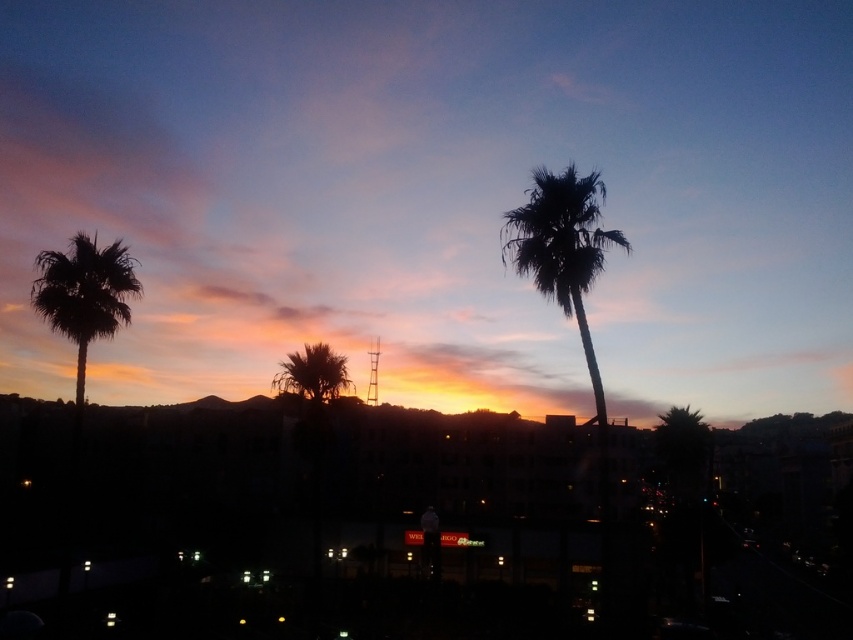
Question: Which object appears farthest from the camera in this image?

Choices:
 (A) silky brown palm tree at center
 (B) silhouette palm at center

Answer: (A)

Question: Is the position of silhouette palm at center less distant than that of silhouette palm at left?

Choices:
 (A) yes
 (B) no

Answer: (A)

Question: Does silhouette palm at center have a smaller size compared to silky brown palm tree at center?

Choices:
 (A) yes
 (B) no

Answer: (B)

Question: Which object appears farthest from the camera in this image?

Choices:
 (A) silky brown palm tree at center
 (B) silhouette palm at center
 (C) silhouette palm at left

Answer: (A)

Question: Does silhouette palm at left appear on the left side of silky brown palm tree at center?

Choices:
 (A) no
 (B) yes

Answer: (B)

Question: Among these points, which one is nearest to the camera?

Choices:
 (A) click(94, 316)
 (B) click(328, 353)

Answer: (A)